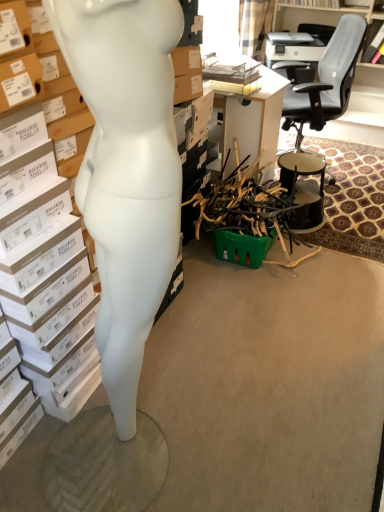
Identify the location of black leather office chair at upper right. The height and width of the screenshot is (512, 384). (327, 81).

Identify the location of black glossy drum at right. (304, 188).

Image resolution: width=384 pixels, height=512 pixels. Describe the element at coordinates (304, 188) in the screenshot. I see `black glossy drum at right` at that location.

At what (x,y) coordinates should I click in order to perform the action: click on white matte mannequin at left. Please return your answer as a coordinate pair (x, y). This screenshot has width=384, height=512. Looking at the image, I should click on (126, 170).

Where is `white cardboard box at left`? white cardboard box at left is located at coordinates (45, 289).

There is a black glossy drum at right. Where is `chair above it (from a real-world perspective)`? This screenshot has width=384, height=512. chair above it (from a real-world perspective) is located at coordinates (327, 81).

Can you confirm if black leather office chair at upper right is bigger than black glossy drum at right?

Indeed, black leather office chair at upper right has a larger size compared to black glossy drum at right.

Based on the photo, from a real-world perspective, is black leather office chair at upper right under black glossy drum at right?

Incorrect, from a real-world perspective, black leather office chair at upper right is higher than black glossy drum at right.

Between point (70, 402) and point (293, 225), which one is positioned in front?

The point (70, 402) is closer.

Is white cardboard box at left to the right of black glossy drum at right from the viewer's perspective?

No, white cardboard box at left is not to the right of black glossy drum at right.

Is white cardboard box at left taller than black glossy drum at right?

Correct, white cardboard box at left is much taller as black glossy drum at right.

Does white matte mannequin at left have a greater width compared to black glossy drum at right?

No, white matte mannequin at left is not wider than black glossy drum at right.

Considering the relative sizes of white matte mannequin at left and black glossy drum at right in the image provided, is white matte mannequin at left shorter than black glossy drum at right?

In fact, white matte mannequin at left may be taller than black glossy drum at right.

In the scene shown: Is white matte mannequin at left positioned with its back to black glossy drum at right?

No.

From a real-world perspective, is white matte mannequin at left beneath black glossy drum at right?

Actually, white matte mannequin at left is physically above black glossy drum at right in the real world.

Considering the relative sizes of black glossy drum at right and white matte mannequin at left in the image provided, is black glossy drum at right bigger than white matte mannequin at left?

No.

From the image's perspective, which is below, black glossy drum at right or white matte mannequin at left?

white matte mannequin at left is shown below in the image.

Is black glossy drum at right in contact with white matte mannequin at left?

No.

Is point (296, 217) farther from camera compared to point (103, 116)?

Yes, it is.

Is black glossy drum at right next to white cardboard box at left and touching it?

black glossy drum at right and white cardboard box at left are clearly separated.

Considering the relative sizes of black glossy drum at right and white cardboard box at left in the image provided, is black glossy drum at right smaller than white cardboard box at left?

Yes.

The width and height of the screenshot is (384, 512). I want to click on book in front of the black glossy drum at right, so click(45, 289).

From the image's perspective, is black glossy drum at right located above black leather office chair at upper right?

No.

From a real-world perspective, is black glossy drum at right physically below black leather office chair at upper right?

Yes.

At what (x,y) coordinates should I click in order to perform the action: click on chair behind the black glossy drum at right. Please return your answer as a coordinate pair (x, y). Looking at the image, I should click on (327, 81).

Is black glossy drum at right not inside black leather office chair at upper right?

black glossy drum at right lies outside black leather office chair at upper right's area.

Is black leather office chair at upper right a part of white cardboard box at left?

Actually, black leather office chair at upper right is outside white cardboard box at left.

From the image's perspective, is white cardboard box at left positioned above or below black leather office chair at upper right?

Based on their image positions, white cardboard box at left is located beneath black leather office chair at upper right.

Is white cardboard box at left to the left of black leather office chair at upper right from the viewer's perspective?

Yes.

Considering the sizes of objects white cardboard box at left and black leather office chair at upper right in the image provided, who is smaller, white cardboard box at left or black leather office chair at upper right?

With smaller size is white cardboard box at left.

Identify the location of drum that is in front of the black leather office chair at upper right. The width and height of the screenshot is (384, 512). (304, 188).

What are the coordinates of `book above the black glossy drum at right (from a real-world perspective)` in the screenshot? It's located at (45, 289).

Looking at the image, which one is located closer to white cardboard box at left, black glossy drum at right or black leather office chair at upper right?

black glossy drum at right is closer to white cardboard box at left.

Looking at the image, which one is located further to black leather office chair at upper right, white matte mannequin at left or black glossy drum at right?

white matte mannequin at left.

In the scene shown: Which object lies nearer to the anchor point white cardboard box at left, black glossy drum at right or white matte mannequin at left?

Among the two, white matte mannequin at left is located nearer to white cardboard box at left.

Based on their spatial positions, is white matte mannequin at left or black leather office chair at upper right further from black glossy drum at right?

Among the two, white matte mannequin at left is located further to black glossy drum at right.

From the image, which object appears to be nearer to white cardboard box at left, white matte mannequin at left or black leather office chair at upper right?

The object closer to white cardboard box at left is white matte mannequin at left.

Based on their spatial positions, is black leather office chair at upper right or white cardboard box at left closer to black glossy drum at right?

black leather office chair at upper right.

Based on their spatial positions, is white cardboard box at left or black glossy drum at right further from black leather office chair at upper right?

white cardboard box at left lies further to black leather office chair at upper right than the other object.

Considering their positions, is white cardboard box at left positioned closer to black leather office chair at upper right than white matte mannequin at left?

white cardboard box at left is closer to black leather office chair at upper right.

This screenshot has width=384, height=512. I want to click on drum positioned between white cardboard box at left and black leather office chair at upper right from near to far, so click(x=304, y=188).

You are a GUI agent. You are given a task and a screenshot of the screen. Output one action in this format:
    pyautogui.click(x=<x>, y=<y>)
    Task: Click on the drum between white matte mannequin at left and black leather office chair at upper right along the z-axis
    The height and width of the screenshot is (512, 384).
    Given the screenshot: What is the action you would take?
    pyautogui.click(x=304, y=188)

At what (x,y) coordinates should I click in order to perform the action: click on book positioned between white matte mannequin at left and black leather office chair at upper right from near to far. Please return your answer as a coordinate pair (x, y). The width and height of the screenshot is (384, 512). Looking at the image, I should click on (45, 289).

This screenshot has width=384, height=512. I want to click on book between white matte mannequin at left and black glossy drum at right from front to back, so click(45, 289).